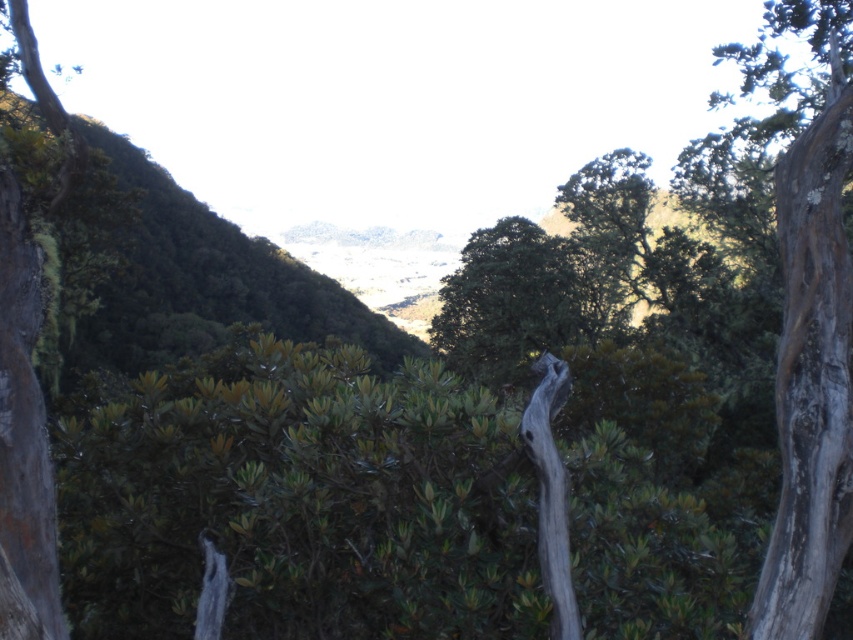
You are a hiker standing at the top of the hill looking down. You notice the gray textured bark at right and the green leafy tree at center. Which one appears taller from your vantage point?

The gray textured bark at right appears much taller than the green leafy tree at center from your vantage point.

You are standing at the top of the hill and want to walk towards the gray textured bark at right and the green leafy tree at center. Which object will you encounter first as you descend the slope?

You will encounter the gray textured bark at right first because it is closer to the viewer than the green leafy tree at center.

You are an ecologist studying the vegetation in this landscape. You notice the gray textured bark at right and the green leafy tree at center. Which of these two has a larger physical size according to your observations?

The gray textured bark at right is bigger than the green leafy tree at center.